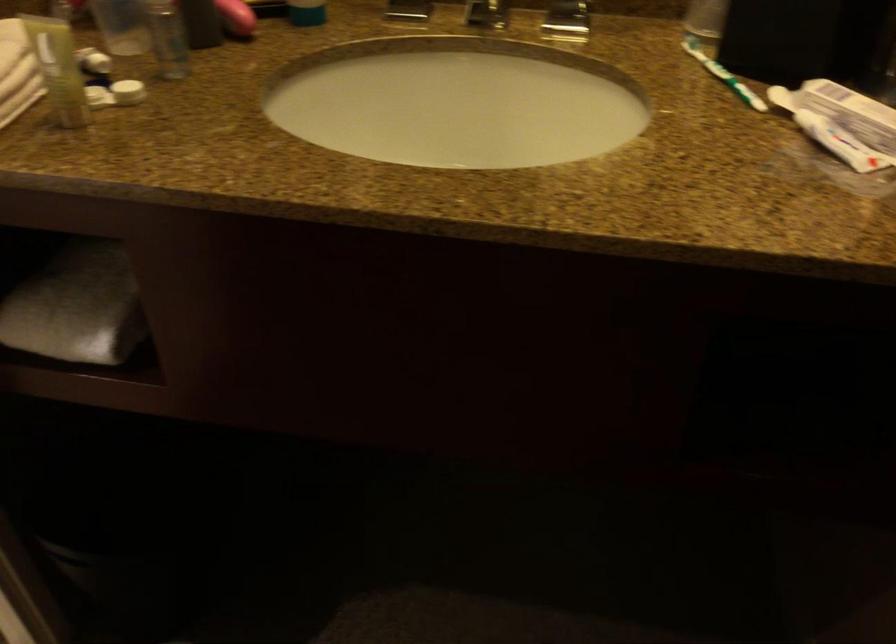
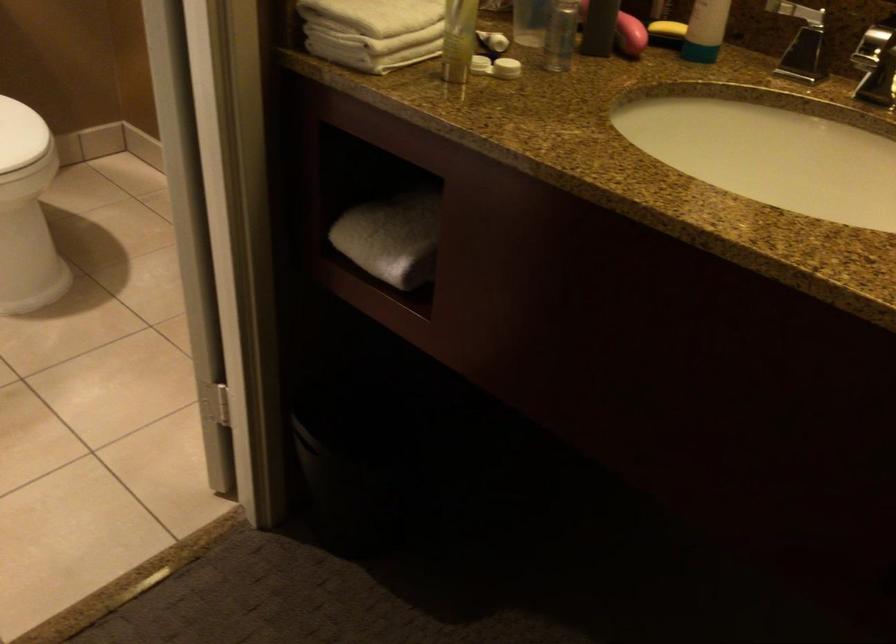
The point at (95, 96) is marked in the first image. Where is the corresponding point in the second image?

(479, 64)